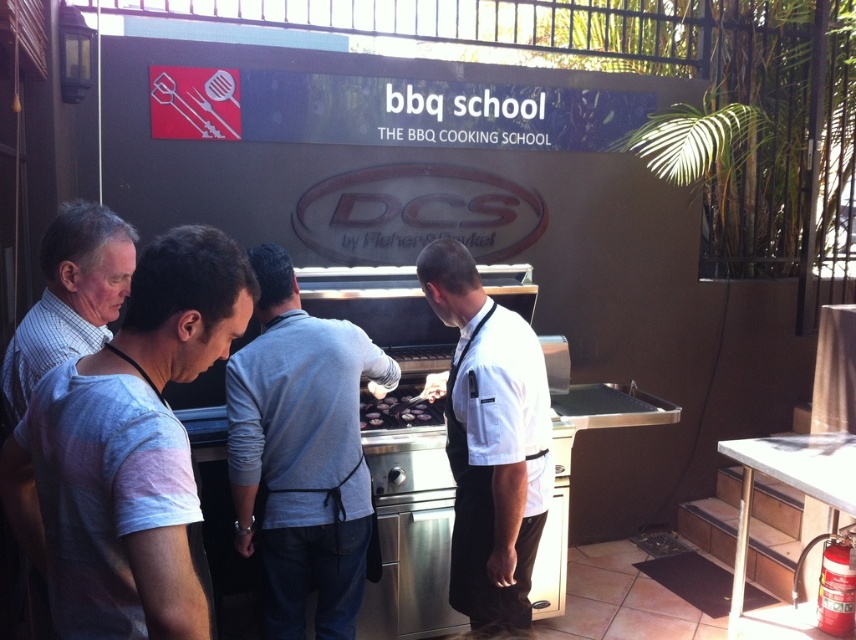
You are a photographer at The BBQ Cooking School and need to capture a clear shot of the black matte grill at center without the white checkered shirt at left blocking it. Given their sizes, which one should you move closer to the camera to achieve this?

The white checkered shirt at left is larger in size compared to the black matte grill at center. To prevent the shirt from blocking the grill, you should move the white checkered shirt at left closer to the camera so it appears smaller in the frame, allowing the black matte grill at center to be visible.